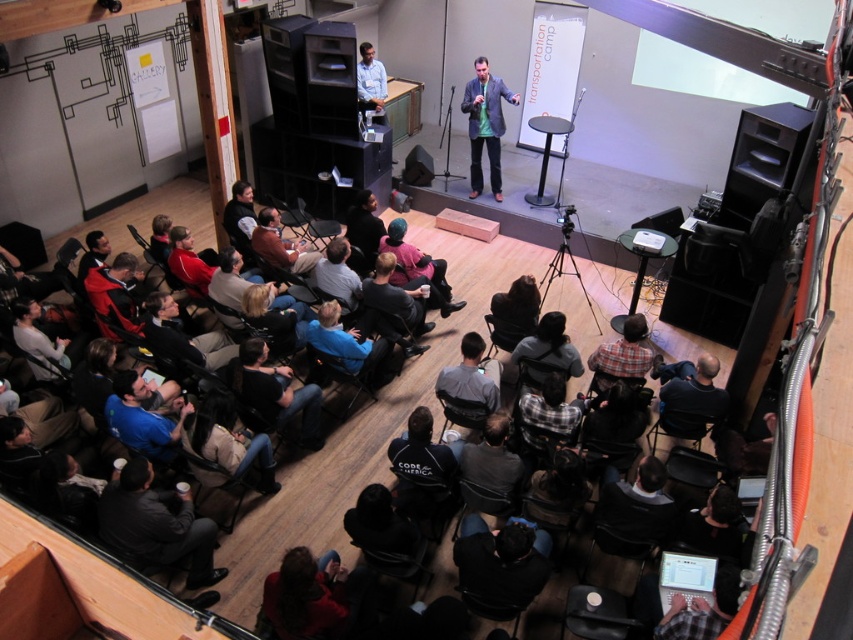
Question: Which point is closer to the camera taking this photo?

Choices:
 (A) (15, 310)
 (B) (247, 339)
 (C) (381, 124)
 (D) (389, 428)

Answer: (B)

Question: Which point is closer to the camera taking this photo?

Choices:
 (A) (126, 260)
 (B) (625, 356)
 (C) (525, 278)
 (D) (245, 372)

Answer: (D)

Question: Considering the relative positions of dark gray chairs at lower left and dark gray fabric jacket at center in the image provided, where is dark gray chairs at lower left located with respect to dark gray fabric jacket at center?

Choices:
 (A) below
 (B) above

Answer: (A)

Question: Does dark gray chairs at lower left appear under dark gray leather jacket at lower left?

Choices:
 (A) yes
 (B) no

Answer: (B)

Question: Which object appears farthest from the camera in this image?

Choices:
 (A) dark gray fabric chair at lower right
 (B) dark brown leather jacket at center

Answer: (B)

Question: Can you confirm if blue fabric shirt at lower left is wider than matte gray sweater at lower left?

Choices:
 (A) no
 (B) yes

Answer: (B)